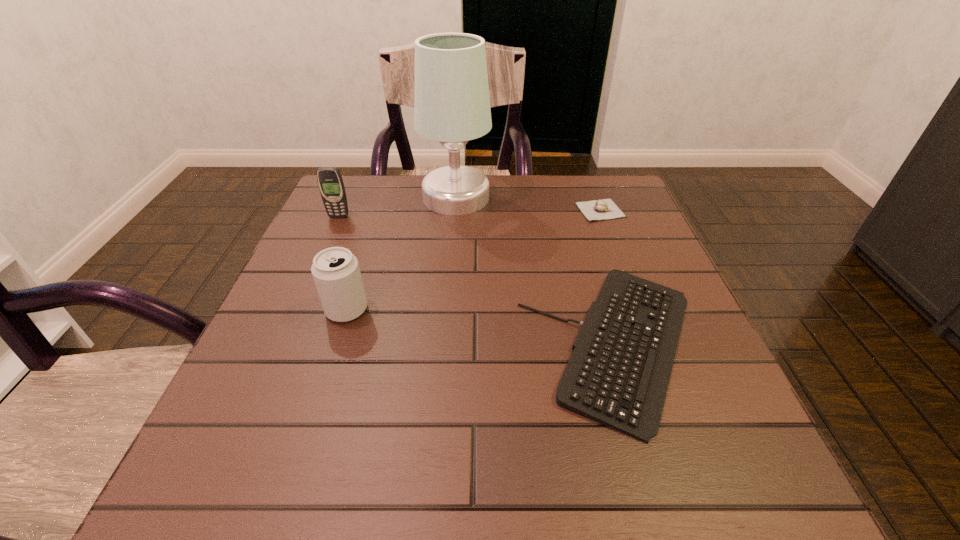
Locate an element on the screen. vacant space positioned 0.270m on the left of the computer keyboard is located at coordinates (370, 344).

You are a GUI agent. You are given a task and a screenshot of the screen. Output one action in this format:
    pyautogui.click(x=<x>, y=<y>)
    Task: Click on the lampshade positioned at the far edge
    
    Given the screenshot: What is the action you would take?
    pyautogui.click(x=452, y=105)

In order to click on cellular telephone present at the far edge in this screenshot , I will do `click(330, 182)`.

At what (x,y) coordinates should I click in order to perform the action: click on garlic that is at the far edge. Please return your answer as a coordinate pair (x, y). Looking at the image, I should click on (603, 209).

You are a GUI agent. You are given a task and a screenshot of the screen. Output one action in this format:
    pyautogui.click(x=<x>, y=<y>)
    Task: Click on the cellular telephone present at the left edge
    
    Given the screenshot: What is the action you would take?
    pyautogui.click(x=330, y=182)

I want to click on can located in the left edge section of the desktop, so [x=336, y=273].

I want to click on garlic that is positioned at the right edge, so click(603, 209).

The image size is (960, 540). Find the location of `computer keyboard located at the right edge`. computer keyboard located at the right edge is located at coordinates coord(618,374).

Locate an element on the screen. Image resolution: width=960 pixels, height=540 pixels. object that is at the far left corner is located at coordinates (330, 182).

Where is `object that is positioned at the far right corner`? object that is positioned at the far right corner is located at coordinates click(603, 209).